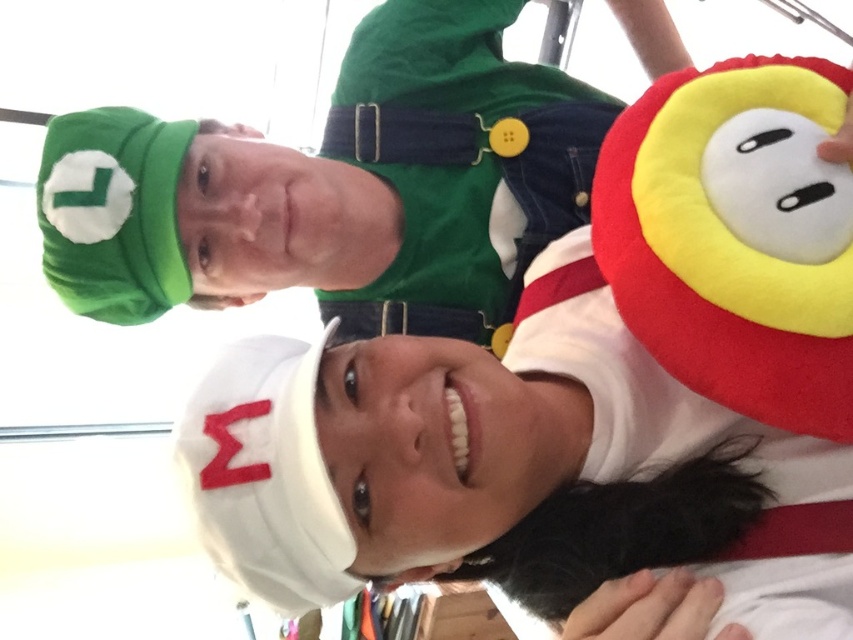
Question: Which of the following is the closest to the observer?

Choices:
 (A) (502, 260)
 (B) (498, 221)
 (C) (589, 253)

Answer: (C)

Question: Which point appears closest to the camera in this image?

Choices:
 (A) (169, 220)
 (B) (352, 292)
 (C) (575, 346)

Answer: (C)

Question: Which object appears closest to the camera in this image?

Choices:
 (A) soft plush hat at right
 (B) velvet green hat at upper left

Answer: (A)

Question: Does velvet green hat at upper left lie in front of soft plush hat at right?

Choices:
 (A) no
 (B) yes

Answer: (A)

Question: Is velvet green hat at upper left smaller than green fabric overalls at center?

Choices:
 (A) yes
 (B) no

Answer: (B)

Question: Does velvet green hat at upper left come behind soft plush hat at right?

Choices:
 (A) yes
 (B) no

Answer: (A)